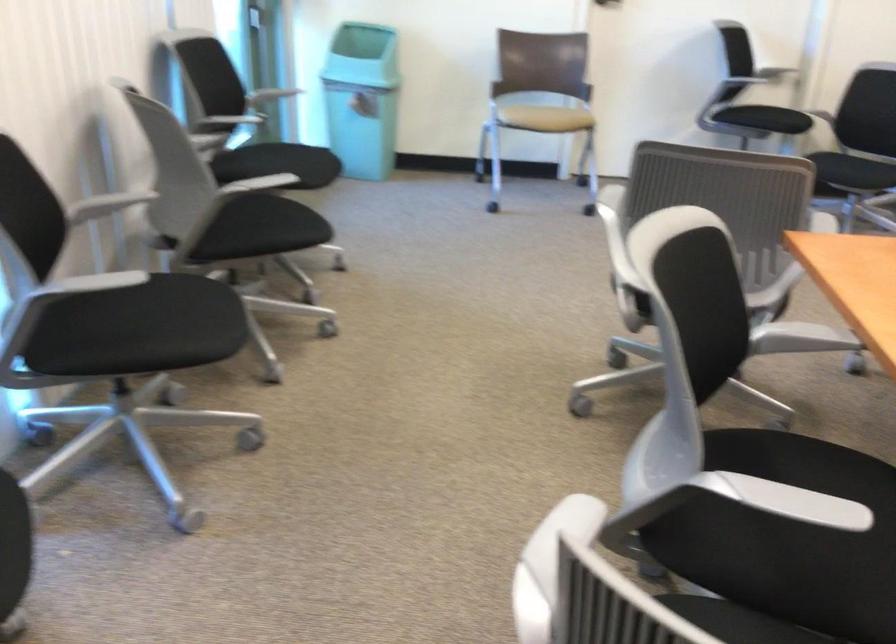
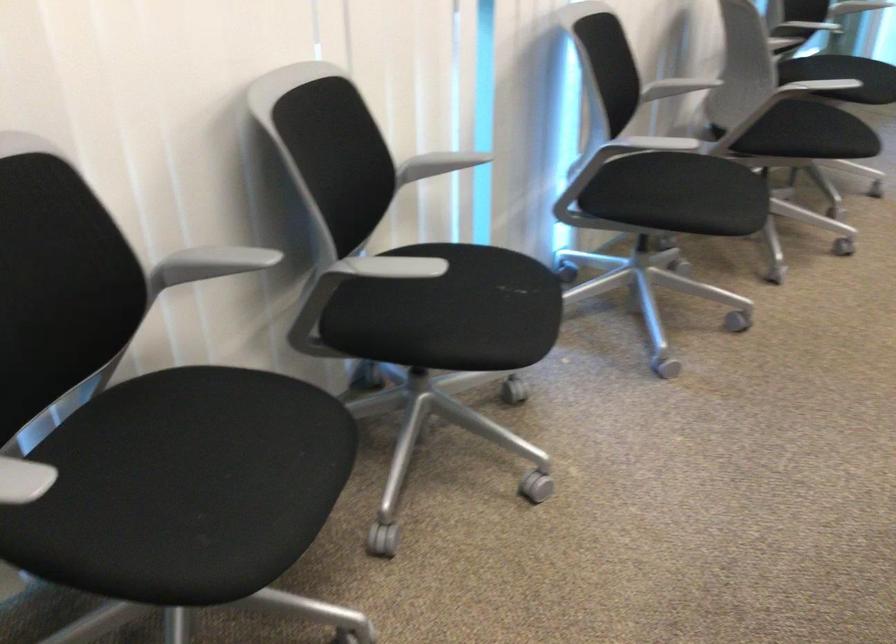
In the second image, find the point that corresponds to point (147, 330) in the first image.

(679, 194)